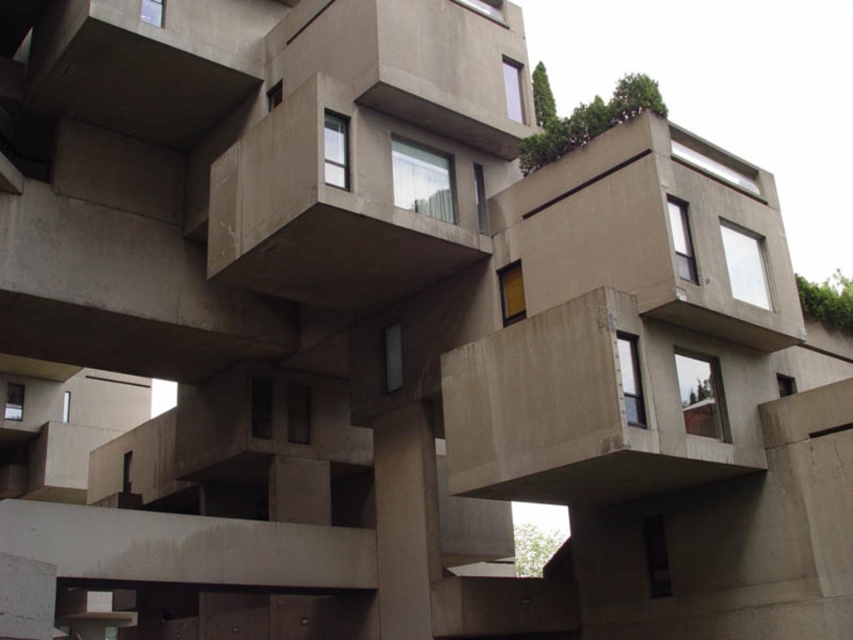
You are an architect inspecting the building. You notice the concrete at center and the concrete balcony at center. Which one is located lower in the structure?

The concrete at center is located lower in the structure because it is below the concrete balcony at center.

You are an architect evaluating the design of the building. You notice the concrete at center and the concrete balcony at center. Which of these two elements takes up more space in the design?

The concrete balcony at center occupies more space than the concrete at center, as stated in the description.

Based on the photo, you are an architect reviewing the design of the modern building. You notice the concrete at center and the concrete balcony at center. Which structure is taller?

The concrete balcony at center is taller than the concrete at center.